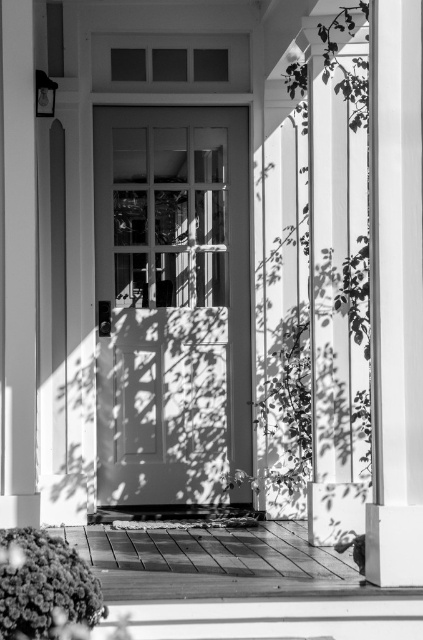
Question: Which of the following is the closest to the observer?

Choices:
 (A) smooth white pillar at right
 (B) matte gray door at center

Answer: (A)

Question: Is smooth white column at right above smooth white pillar at right?

Choices:
 (A) yes
 (B) no

Answer: (B)

Question: Which of the following is the closest to the observer?

Choices:
 (A) smooth white pillar at right
 (B) matte gray door at center
 (C) smooth white column at right

Answer: (C)

Question: Can you confirm if matte gray door at center is smaller than smooth white column at right?

Choices:
 (A) yes
 (B) no

Answer: (B)

Question: Is smooth white column at right bigger than smooth white pillar at right?

Choices:
 (A) no
 (B) yes

Answer: (A)

Question: Among these points, which one is nearest to the camera?

Choices:
 (A) (216, 428)
 (B) (393, 460)
 (C) (331, 500)

Answer: (B)